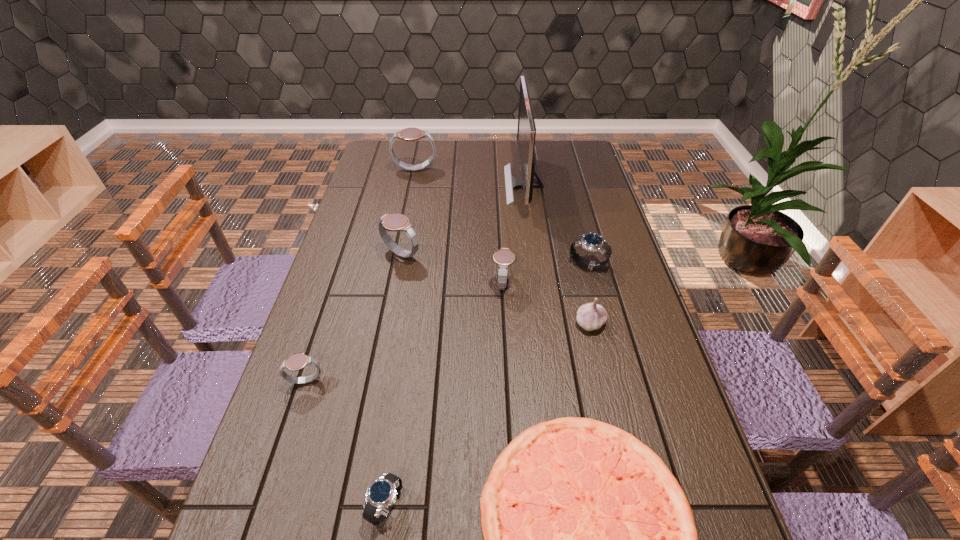
The image size is (960, 540). Find the location of `vacant space that's between the rightmost watch and the tallest object`. vacant space that's between the rightmost watch and the tallest object is located at coordinates (556, 225).

You are a GUI agent. You are given a task and a screenshot of the screen. Output one action in this format:
    pyautogui.click(x=<x>, y=<y>)
    Task: Click on the unoccupied position between the farthest gray watch and the tallest object
    The width and height of the screenshot is (960, 540).
    Given the screenshot: What is the action you would take?
    pyautogui.click(x=469, y=178)

Identify the location of the fifth closest object relative to the fourth nearest object. Image resolution: width=960 pixels, height=540 pixels. (392, 222).

Where is `object that stands as the closest to the second nearest gray watch`? The image size is (960, 540). object that stands as the closest to the second nearest gray watch is located at coordinates (591, 316).

The image size is (960, 540). I want to click on watch that can be found as the fourth closest to the farthest gray watch, so pos(298,361).

The image size is (960, 540). In order to click on the third closest watch to the right silver watch in this screenshot , I will do `click(408, 134)`.

Find the location of a particular element. the second closest gray watch to the third smallest gray watch is located at coordinates (298, 361).

At what (x,y) coordinates should I click in order to perform the action: click on gray watch that is the second closest to the sixth farthest object. Please return your answer as a coordinate pair (x, y). The width and height of the screenshot is (960, 540). Looking at the image, I should click on (392, 222).

At what (x,y) coordinates should I click in order to perform the action: click on blank space that satisfies the following two spatial constraints: 1. on the front side of the white garlic; 2. on the left side of the second biggest gray watch. Please return your answer as a coordinate pair (x, y). The height and width of the screenshot is (540, 960). Looking at the image, I should click on (388, 323).

At what (x,y) coordinates should I click in order to perform the action: click on free space that satisfies the following two spatial constraints: 1. on the back side of the nearer silver watch; 2. on the right side of the right silver watch. Please return your answer as a coordinate pair (x, y). The width and height of the screenshot is (960, 540). Looking at the image, I should click on (420, 265).